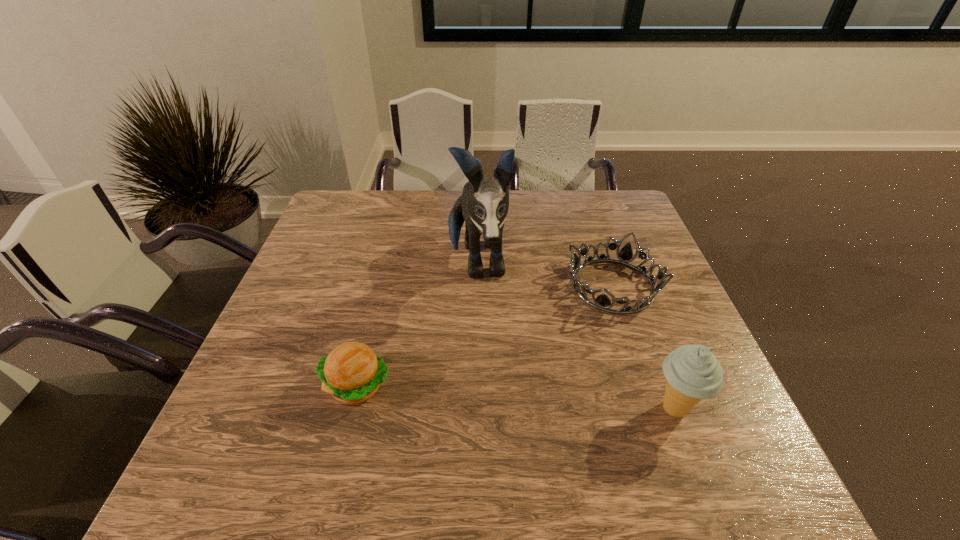
This screenshot has width=960, height=540. Find the location of `vacant point at the far edge`. vacant point at the far edge is located at coordinates [x=448, y=211].

The width and height of the screenshot is (960, 540). I want to click on vacant space at the near edge of the desktop, so click(349, 406).

This screenshot has height=540, width=960. In the image, there is a desktop. Identify the location of vacant space at the left edge. (329, 317).

What are the coordinates of `free location at the right edge` in the screenshot? It's located at (683, 339).

Locate an element on the screen. This screenshot has height=540, width=960. vacant space at the far right corner of the desktop is located at coordinates (646, 230).

Where is `vacant space at the near right corner of the desktop`? vacant space at the near right corner of the desktop is located at coordinates (718, 417).

The image size is (960, 540). What are the coordinates of `blank region between the tallest object and the third shortest object` in the screenshot? It's located at (576, 336).

The image size is (960, 540). Find the location of `empty space between the second object from left to right and the tiara`. empty space between the second object from left to right and the tiara is located at coordinates (544, 274).

I want to click on vacant area that lies between the tiara and the leftmost object, so click(x=485, y=335).

What are the coordinates of `free space that is in between the shortest object and the puppy` in the screenshot? It's located at (544, 274).